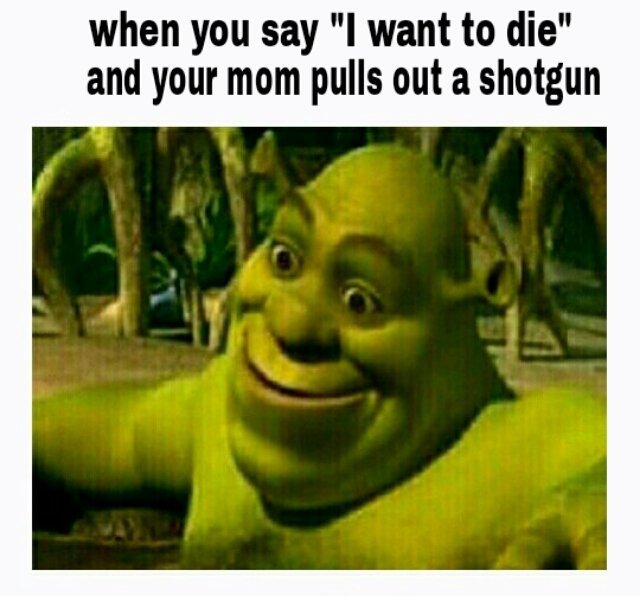
Where is `chest`? This screenshot has height=596, width=640. chest is located at coordinates [292, 552].